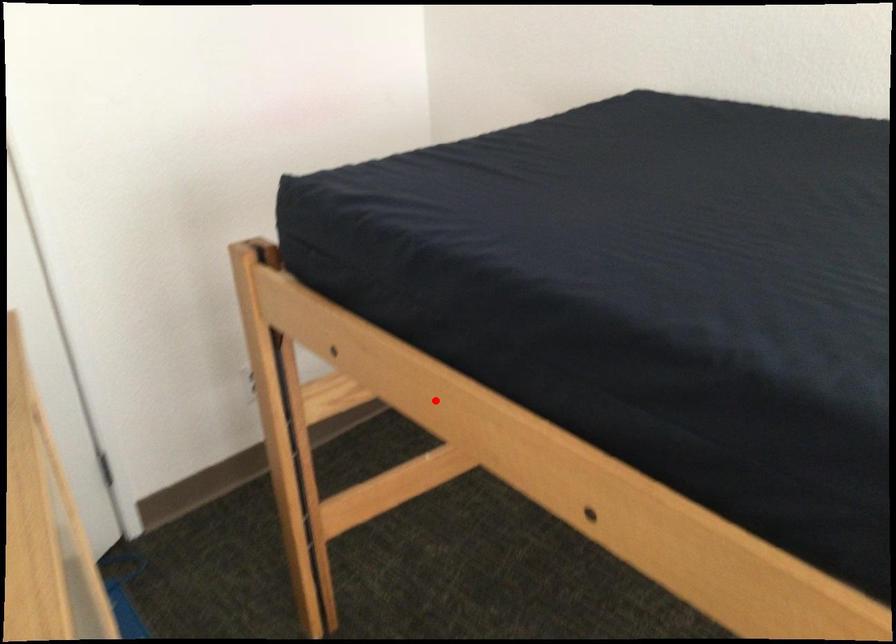
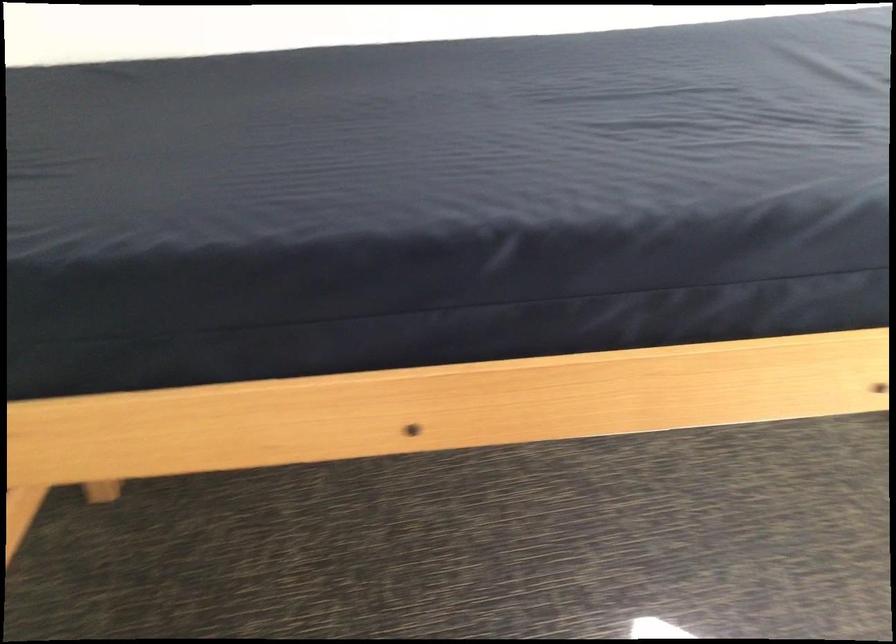
In the second image, find the point that corresponds to the highlighted location in the first image.

(165, 436)